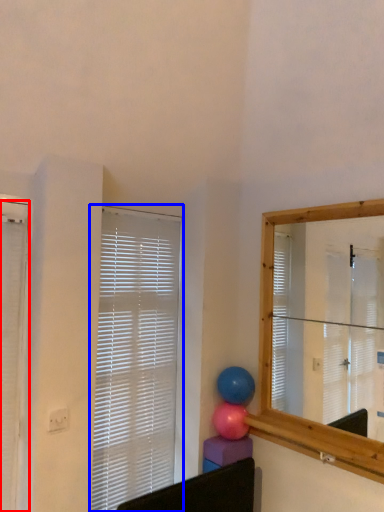
Question: Which object is further to the camera taking this photo, window blind (highlighted by a red box) or window blind (highlighted by a blue box)?

Choices:
 (A) window blind
 (B) window blind

Answer: (B)